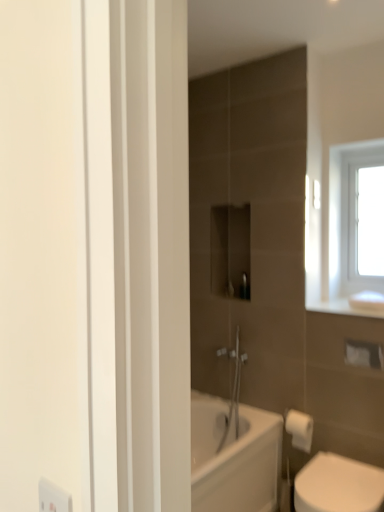
Question: Should I look upward or downward to see white matte toilet paper at lower right?

Choices:
 (A) up
 (B) down

Answer: (B)

Question: Can you confirm if white glossy toilet at lower right is positioned to the left of white matte toilet paper at lower right?

Choices:
 (A) yes
 (B) no

Answer: (B)

Question: Is white glossy toilet at lower right thinner than white matte toilet paper at lower right?

Choices:
 (A) no
 (B) yes

Answer: (A)

Question: Is white glossy toilet at lower right smaller than white matte toilet paper at lower right?

Choices:
 (A) yes
 (B) no

Answer: (B)

Question: Is white glossy toilet at lower right further to the viewer compared to white matte toilet paper at lower right?

Choices:
 (A) no
 (B) yes

Answer: (A)

Question: Is white glossy toilet at lower right not inside white matte toilet paper at lower right?

Choices:
 (A) yes
 (B) no

Answer: (A)

Question: Is white glossy toilet at lower right wider than white matte toilet paper at lower right?

Choices:
 (A) no
 (B) yes

Answer: (B)

Question: Considering the relative sizes of white glass window at upper right and white glossy toilet at lower right in the image provided, is white glass window at upper right bigger than white glossy toilet at lower right?

Choices:
 (A) no
 (B) yes

Answer: (A)

Question: Is white glossy toilet at lower right located within white glass window at upper right?

Choices:
 (A) no
 (B) yes

Answer: (A)

Question: Is white glass window at upper right in front of white glossy toilet at lower right?

Choices:
 (A) no
 (B) yes

Answer: (A)

Question: Is white glass window at upper right at the left side of white glossy toilet at lower right?

Choices:
 (A) yes
 (B) no

Answer: (B)

Question: From the image's perspective, does white glass window at upper right appear lower than white glossy toilet at lower right?

Choices:
 (A) yes
 (B) no

Answer: (B)

Question: Considering the relative sizes of white glass window at upper right and white glossy toilet at lower right in the image provided, is white glass window at upper right taller than white glossy toilet at lower right?

Choices:
 (A) no
 (B) yes

Answer: (B)

Question: Can you confirm if white matte toilet paper at lower right is positioned to the left of white glass window at upper right?

Choices:
 (A) no
 (B) yes

Answer: (B)